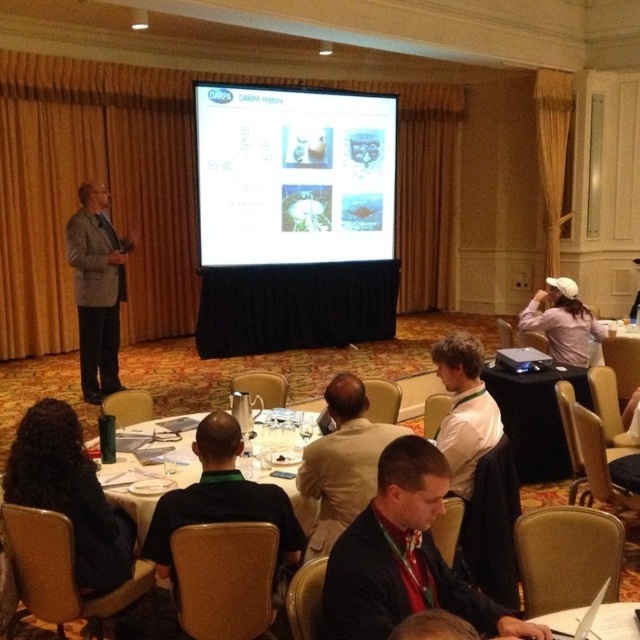
You are an attendee at the conference and want to know which presenter is standing closer to the front of the room. The presenters are wearing a dark suit at center and a dark brown suit at center. Based on their positions, which one is positioned closer to the front?

The dark suit at center is located below dark brown suit at center, so the dark suit at center is positioned closer to the front of the room.

You are sitting at the back of the conference room and want to see which point is closer to you. The points are labeled as point 1 at coordinates point (356,195) and point 2 at coordinates point (461,358). Which point is nearer to your current position?

Point 2 at coordinates point (461,358) is closer to you because it is less further to the camera compared to point 1 at coordinates point (356,195).